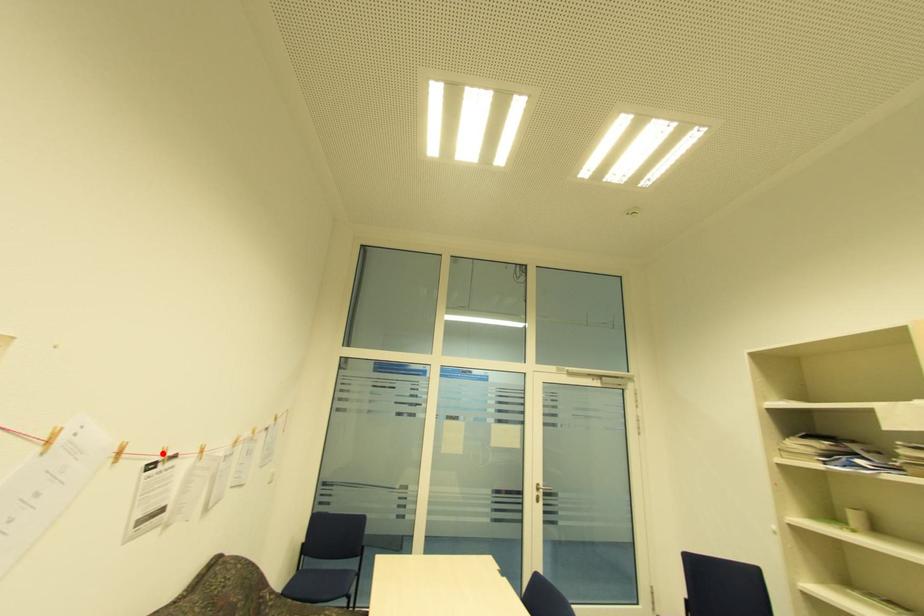
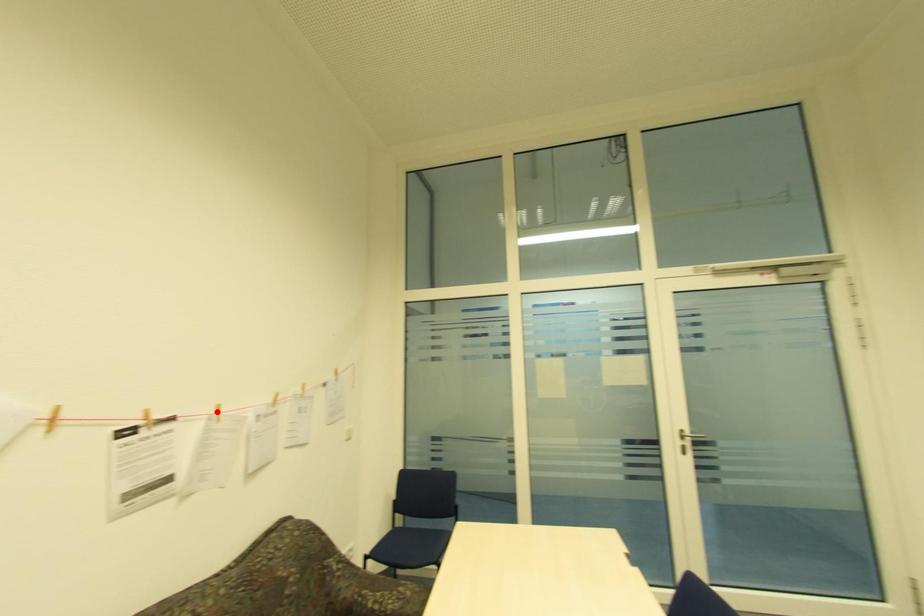
I am providing you with two images of the same scene from different viewpoints. A red point is marked on the first image and another point is marked on the second image. Is the red point in image1 aligned with the point shown in image2?

No